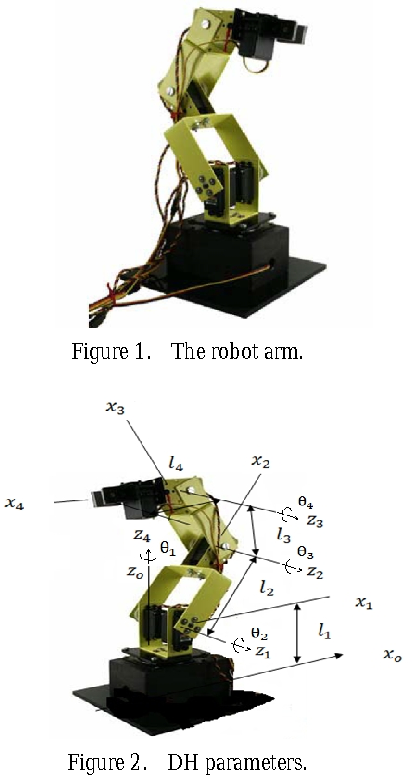
At what (x,y) coordinates should I click in order to perform the action: click on wires. Please return your answer as a coordinate pair (x, y). The height and width of the screenshot is (776, 412). Looking at the image, I should click on (107, 295), (256, 272), (178, 184), (217, 513), (158, 163), (252, 70), (250, 217).